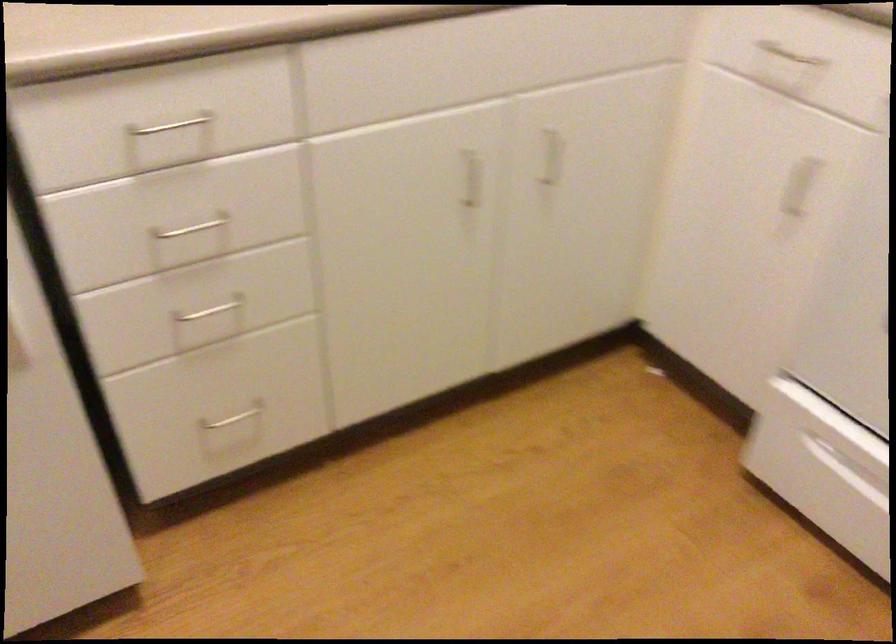
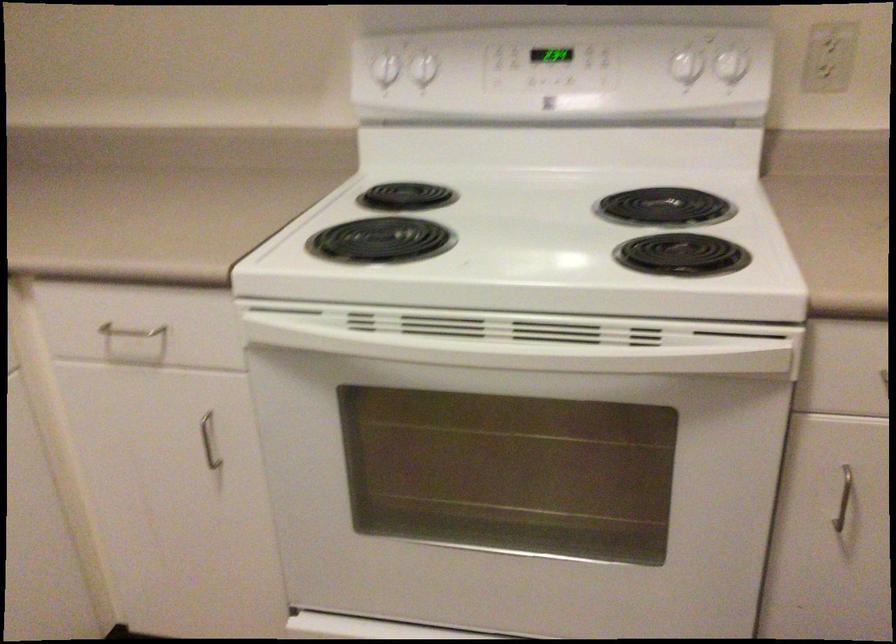
In the second image, find the point that corresponds to point (797, 189) in the first image.

(209, 440)